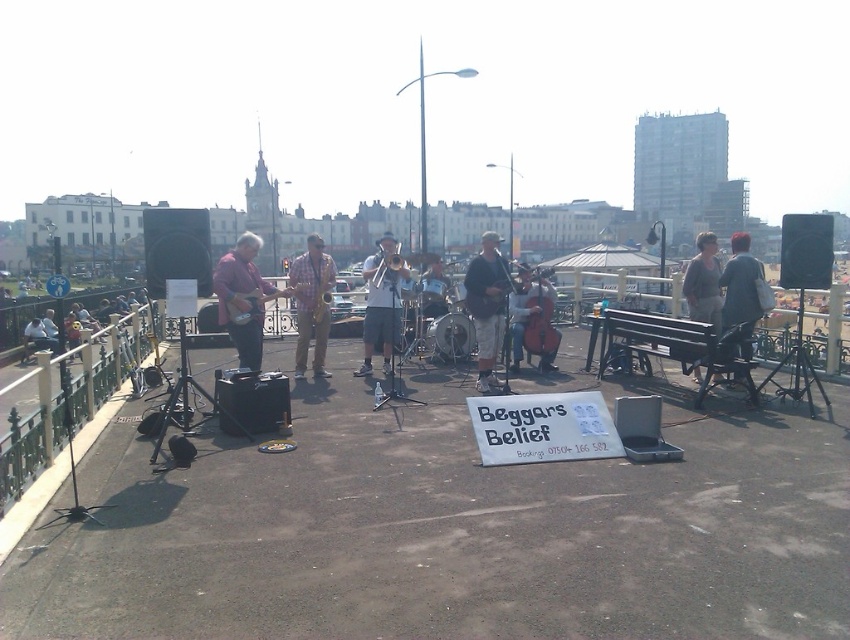
Question: Is denim jacket at right positioned at the back of satin gold saxophone at center?

Choices:
 (A) no
 (B) yes

Answer: (A)

Question: Which of these objects is positioned closest to the brushed metal guitar at left?

Choices:
 (A) brushed metal saxophone at center
 (B) matte black trombone at center
 (C) matte black guitar at center

Answer: (A)

Question: Does matte black guitar at center appear over brushed metal saxophone at center?

Choices:
 (A) yes
 (B) no

Answer: (B)

Question: Estimate the real-world distances between objects in this image. Which object is farther from the checkered fabric saxophone at center?

Choices:
 (A) matte black trombone at center
 (B) denim jacket at right
 (C) brushed metal guitar at left

Answer: (A)

Question: In this image, where is checkered fabric saxophone at center located relative to brushed metal saxophone at center?

Choices:
 (A) below
 (B) above

Answer: (A)

Question: Which of the following is the closest to the observer?

Choices:
 (A) (380, 259)
 (B) (367, 304)
 (C) (316, 314)
 (D) (236, 324)

Answer: (D)